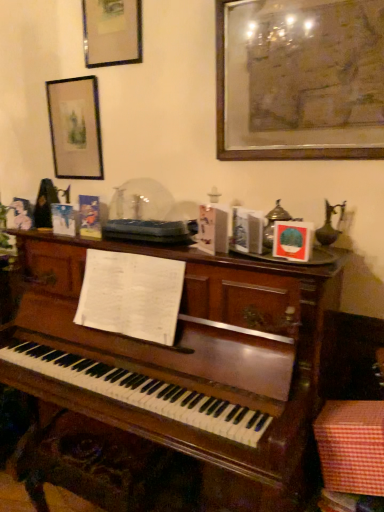
Question: Can you confirm if matte black picture frame at upper left, the first picture frame from the left, is wider than checkered fabric box at lower right?

Choices:
 (A) yes
 (B) no

Answer: (B)

Question: Are matte black picture frame at upper left, the first picture frame from the left, and checkered fabric box at lower right far apart?

Choices:
 (A) no
 (B) yes

Answer: (B)

Question: Is matte black picture frame at upper left, the first picture frame from the left, completely or partially outside of checkered fabric box at lower right?

Choices:
 (A) yes
 (B) no

Answer: (A)

Question: Is the position of matte black picture frame at upper left, the first picture frame from the left, more distant than that of checkered fabric box at lower right?

Choices:
 (A) yes
 (B) no

Answer: (A)

Question: Is matte black picture frame at upper left, the first picture frame from the left, thinner than checkered fabric box at lower right?

Choices:
 (A) yes
 (B) no

Answer: (A)

Question: Looking at their shapes, would you say matte black picture frame at upper left, placed as the 1th picture frame when sorted from back to front, is wider or thinner than wooden framed artwork at upper right, marked as the third picture frame in a back-to-front arrangement?

Choices:
 (A) thin
 (B) wide

Answer: (A)

Question: Is matte black picture frame at upper left, which appears as the 3th picture frame when viewed from the front, bigger or smaller than wooden framed artwork at upper right, marked as the third picture frame in a back-to-front arrangement?

Choices:
 (A) big
 (B) small

Answer: (B)

Question: From their relative heights in the image, would you say matte black picture frame at upper left, placed as the 1th picture frame when sorted from back to front, is taller or shorter than wooden framed artwork at upper right, the 1th picture frame from the front?

Choices:
 (A) short
 (B) tall

Answer: (A)

Question: From the image's perspective, is matte black picture frame at upper left, the first picture frame from the left, located above or below wooden framed artwork at upper right, the 1th picture frame from the front?

Choices:
 (A) above
 (B) below

Answer: (B)

Question: From a real-world perspective, is matte black picture frame at upper left, arranged as the second picture frame when viewed from the back, positioned above or below matte black picture frame at upper left, acting as the 3th picture frame starting from the right?

Choices:
 (A) above
 (B) below

Answer: (A)

Question: Is matte black picture frame at upper left, arranged as the 2th picture frame when viewed from the right, taller or shorter than matte black picture frame at upper left, placed as the 1th picture frame when sorted from back to front?

Choices:
 (A) short
 (B) tall

Answer: (A)

Question: Looking at their shapes, would you say matte black picture frame at upper left, arranged as the 2th picture frame when viewed from the right, is wider or thinner than matte black picture frame at upper left, acting as the 3th picture frame starting from the right?

Choices:
 (A) thin
 (B) wide

Answer: (A)

Question: Is matte black picture frame at upper left, arranged as the second picture frame when viewed from the back, bigger or smaller than matte black picture frame at upper left, acting as the 3th picture frame starting from the right?

Choices:
 (A) small
 (B) big

Answer: (A)

Question: Considering the positions of point (329, 421) and point (129, 27), is point (329, 421) closer or farther from the camera than point (129, 27)?

Choices:
 (A) farther
 (B) closer

Answer: (B)

Question: From a real-world perspective, is checkered fabric box at lower right physically located above or below matte black picture frame at upper left, arranged as the 2th picture frame when viewed from the right?

Choices:
 (A) above
 (B) below

Answer: (B)